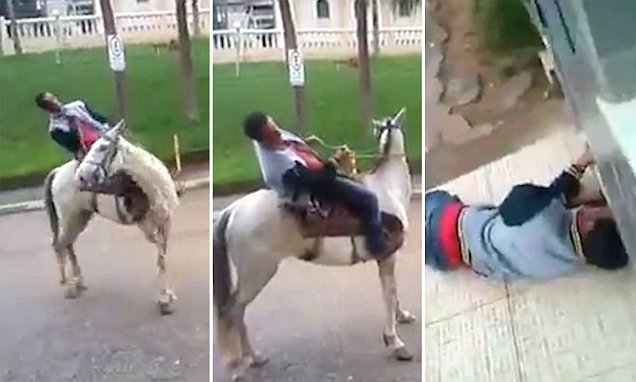
Locate an element on the screen. The width and height of the screenshot is (636, 382). mat is located at coordinates (534, 329).